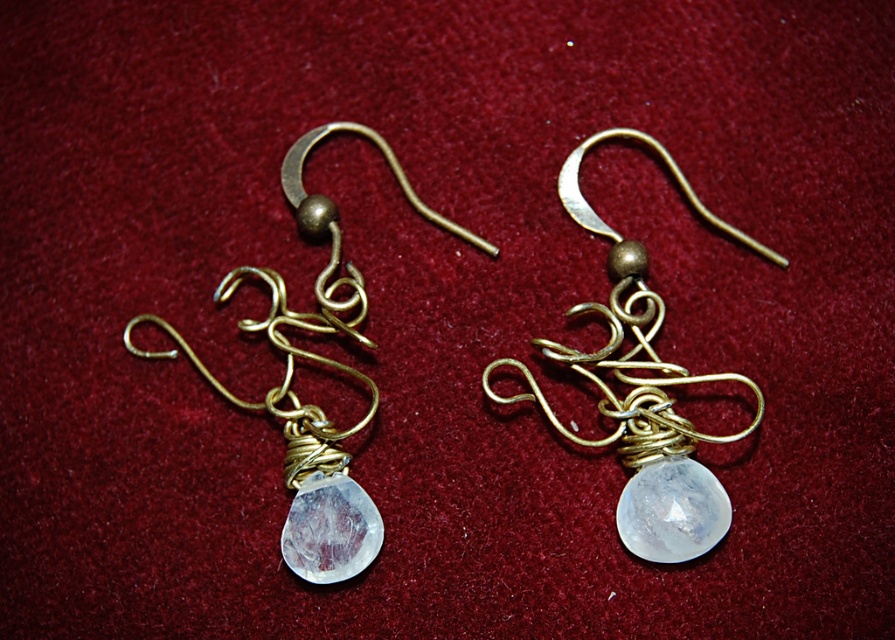
Who is lower down, matte gold wire at center or matte gold wire at left?

matte gold wire at left is below.

Between matte gold wire at center and matte gold wire at left, which one appears on the left side from the viewer's perspective?

matte gold wire at left

Locate an element on the screen. The height and width of the screenshot is (640, 895). matte gold wire at center is located at coordinates (644, 387).